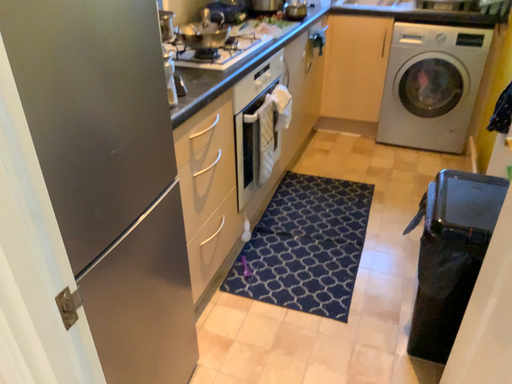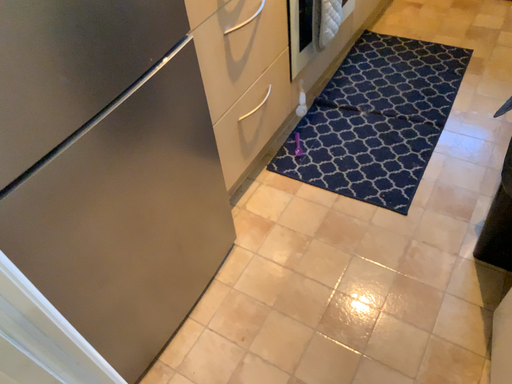
Question: Which way did the camera rotate in the video?

Choices:
 (A) rotated left
 (B) rotated right

Answer: (A)